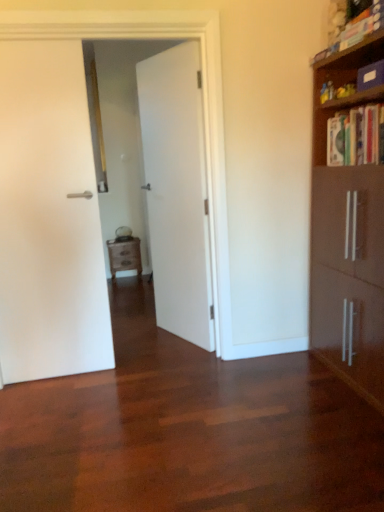
At what (x,y) coordinates should I click in order to perform the action: click on vacant point to the right of white matte door at left, arranged as the first door when viewed from the left. Please return your answer as a coordinate pair (x, y). The width and height of the screenshot is (384, 512). Looking at the image, I should click on (122, 378).